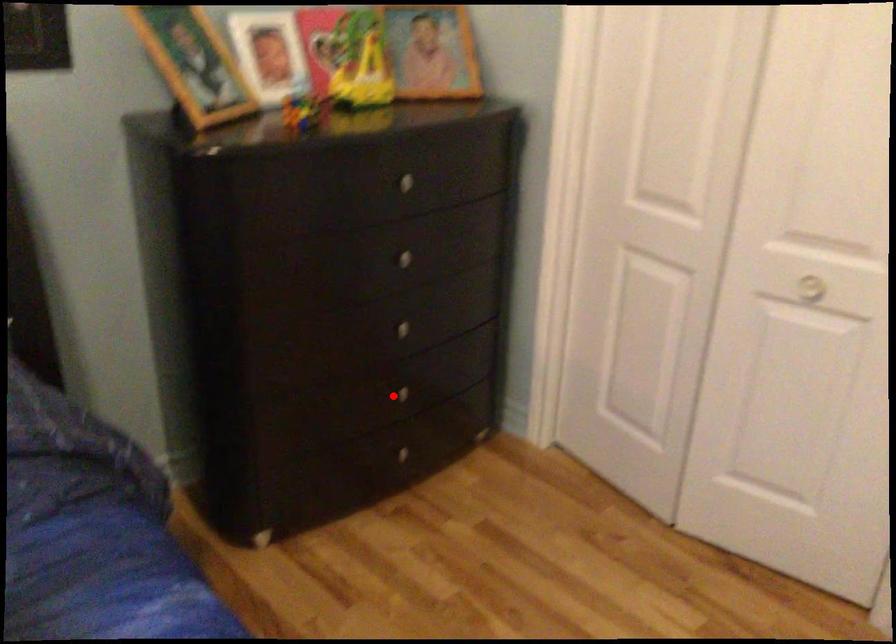
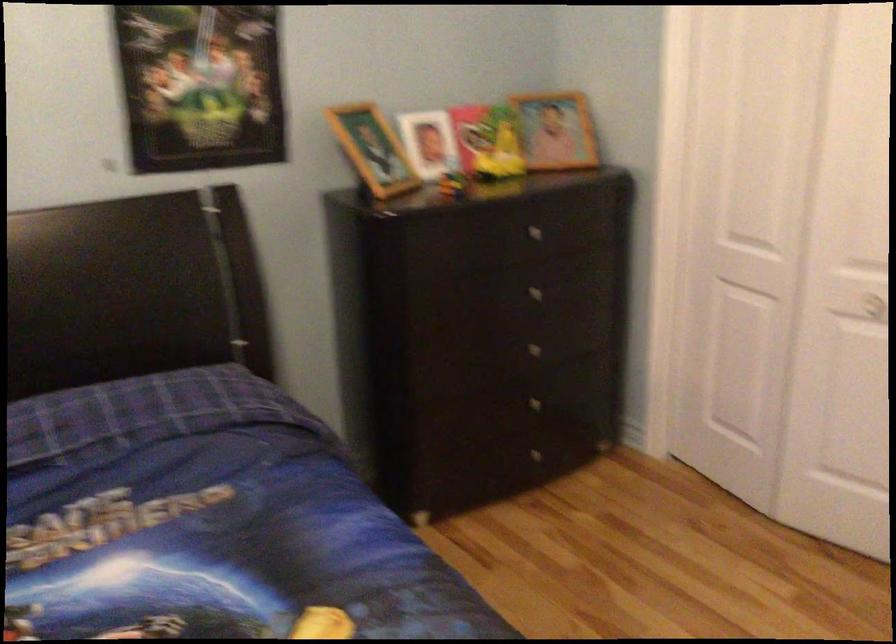
Question: I am providing you with two images of the same scene from different viewpoints. A red point is shown in image1. For the corresponding object point in image2, is it positioned nearer or farther from the camera?

Choices:
 (A) Nearer
 (B) Farther

Answer: (B)